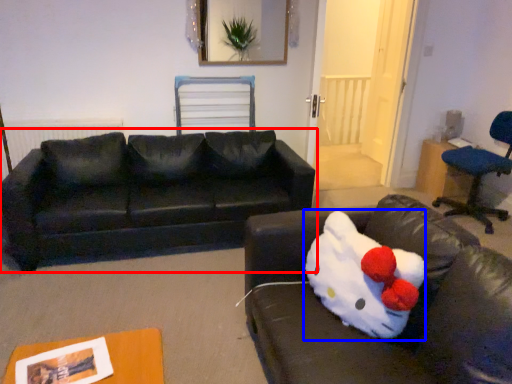
Question: Which point is further to the camera, studio couch (highlighted by a red box) or animal (highlighted by a blue box)?

Choices:
 (A) studio couch
 (B) animal

Answer: (A)